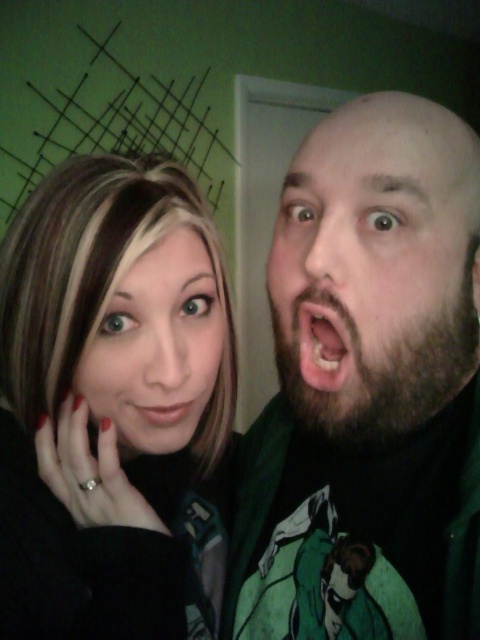
Question: Is bearded face at right to the left of matte skin face at left from the viewer's perspective?

Choices:
 (A) no
 (B) yes

Answer: (A)

Question: Which is farther from the matte pink lips at center?

Choices:
 (A) matte skin face at left
 (B) bearded face at right
 (C) beige matte skin at center
 (D) dark brown beard at right

Answer: (B)

Question: Can you confirm if matte skin face at left is positioned to the right of beige matte skin at center?

Choices:
 (A) yes
 (B) no

Answer: (B)

Question: Which of the following is the closest to the observer?

Choices:
 (A) (188, 234)
 (B) (324, 176)
 (C) (157, 413)
 (D) (407, 97)

Answer: (B)

Question: Can you confirm if beige matte skin at center is positioned above matte pink lips at center?

Choices:
 (A) yes
 (B) no

Answer: (A)

Question: Which point is farther from the camera taking this photo?

Choices:
 (A) (170, 330)
 (B) (402, 164)
 (C) (202, 448)

Answer: (C)